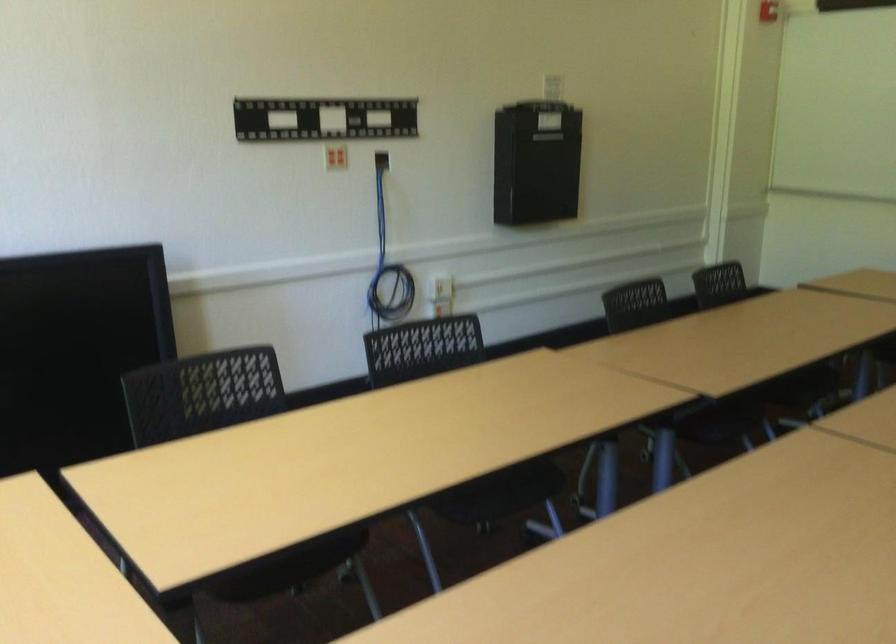
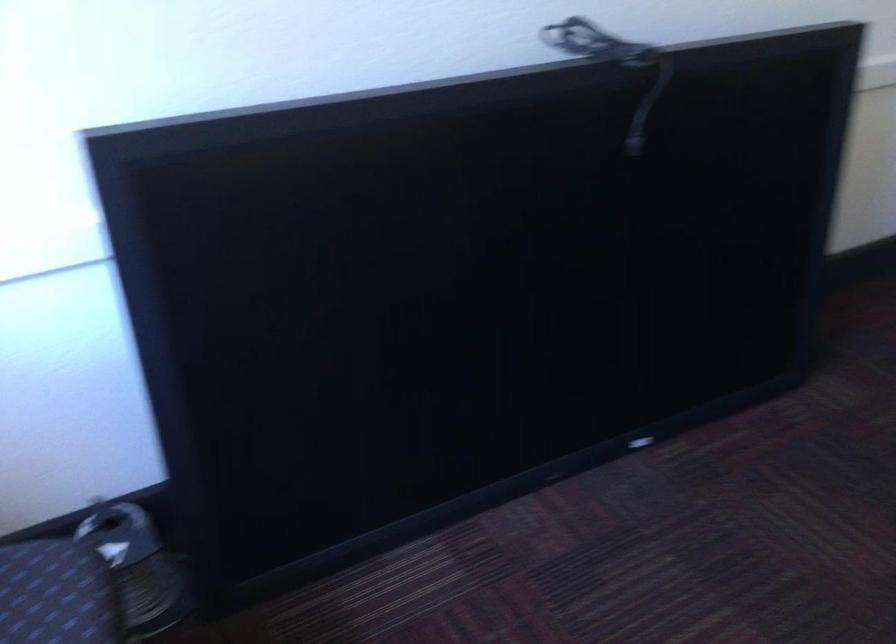
The images are taken continuously from a first-person perspective. In which direction are you moving?

The cameraman walked toward left, forward.